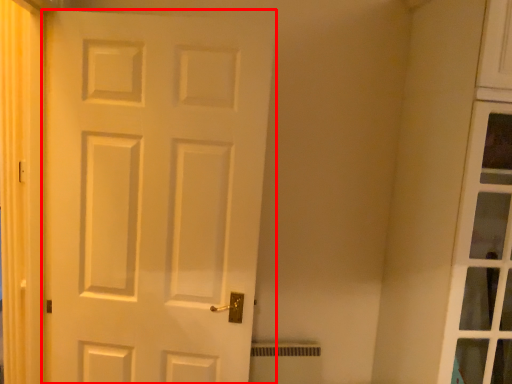
Question: From the image's perspective, where is door (annotated by the red box) located relative to curtain?

Choices:
 (A) above
 (B) below

Answer: (B)